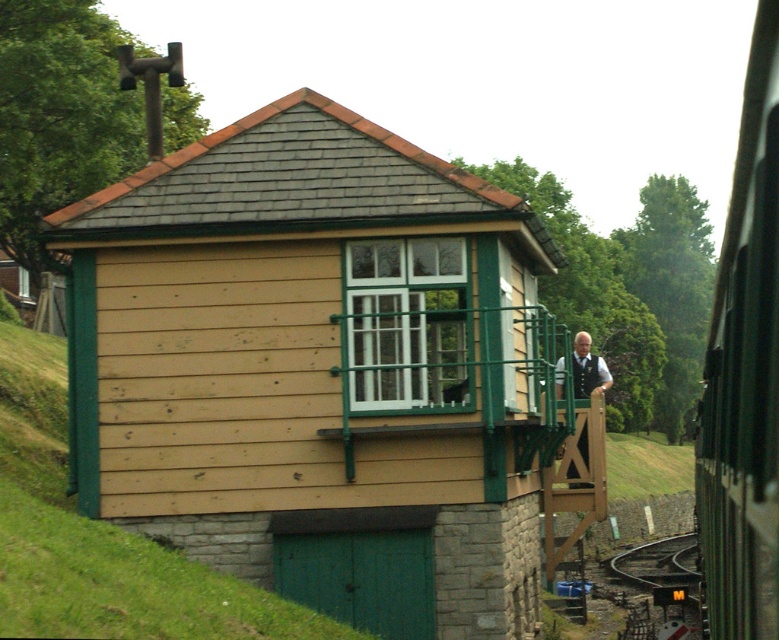
Consider the image. Does green metallic train at right appear over green textured vest at center?

Incorrect, green metallic train at right is not positioned above green textured vest at center.

Which is below, green metallic train at right or green textured vest at center?

green metallic train at right

Consider the image. Who is more forward, (749, 58) or (580, 452)?

Point (749, 58) is in front.

Image resolution: width=779 pixels, height=640 pixels. Identify the location of green metallic train at right. (744, 372).

Which is more to the left, green metal balcony at center or smooth metal train track at lower right?

green metal balcony at center

Which is behind, point (432, 400) or point (665, 570)?

Point (665, 570)

Find the location of a particular element. Image resolution: width=779 pixels, height=640 pixels. green metal balcony at center is located at coordinates (453, 369).

Where is `green metal balcony at center`? The width and height of the screenshot is (779, 640). green metal balcony at center is located at coordinates (453, 369).

Who is more forward, (434, 410) or (456, 388)?

Positioned in front is point (434, 410).

Image resolution: width=779 pixels, height=640 pixels. What do you see at coordinates (453, 369) in the screenshot?
I see `green metal balcony at center` at bounding box center [453, 369].

Does point (411, 328) come in front of point (467, 400)?

Yes, it is in front of point (467, 400).

Identify the location of green metal balcony at center. The height and width of the screenshot is (640, 779). (453, 369).